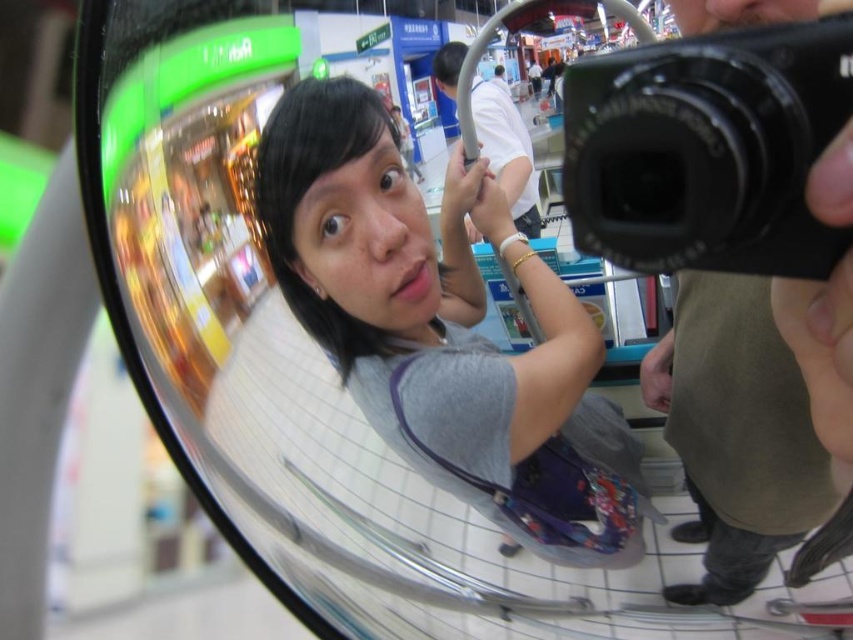
Who is lower down, gray fabric shirt at center or black plastic camera at upper right?

gray fabric shirt at center is below.

Can you confirm if gray fabric shirt at center is wider than black plastic camera at upper right?

Yes.

This screenshot has height=640, width=853. Describe the element at coordinates (434, 317) in the screenshot. I see `gray fabric shirt at center` at that location.

Where is `gray fabric shirt at center`? The image size is (853, 640). gray fabric shirt at center is located at coordinates (434, 317).